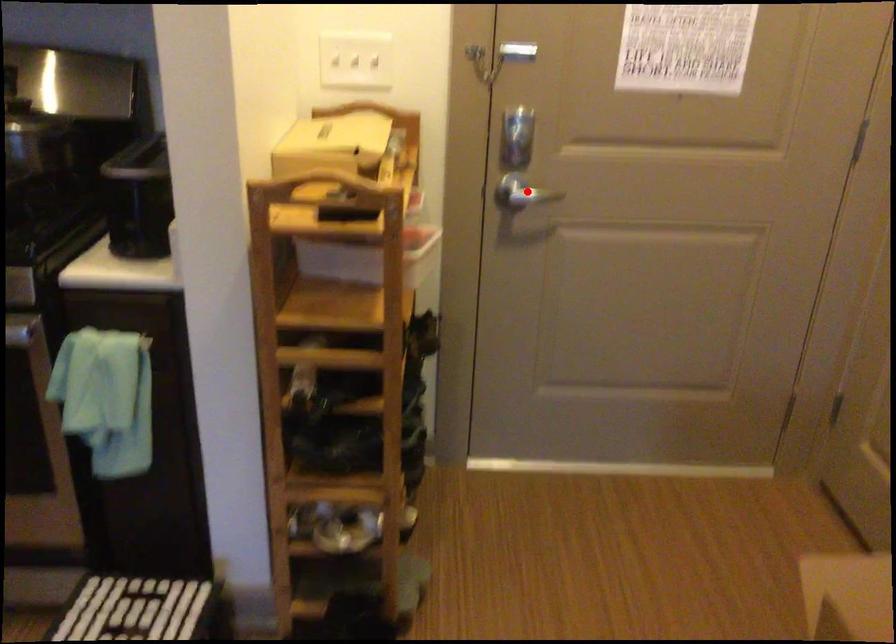
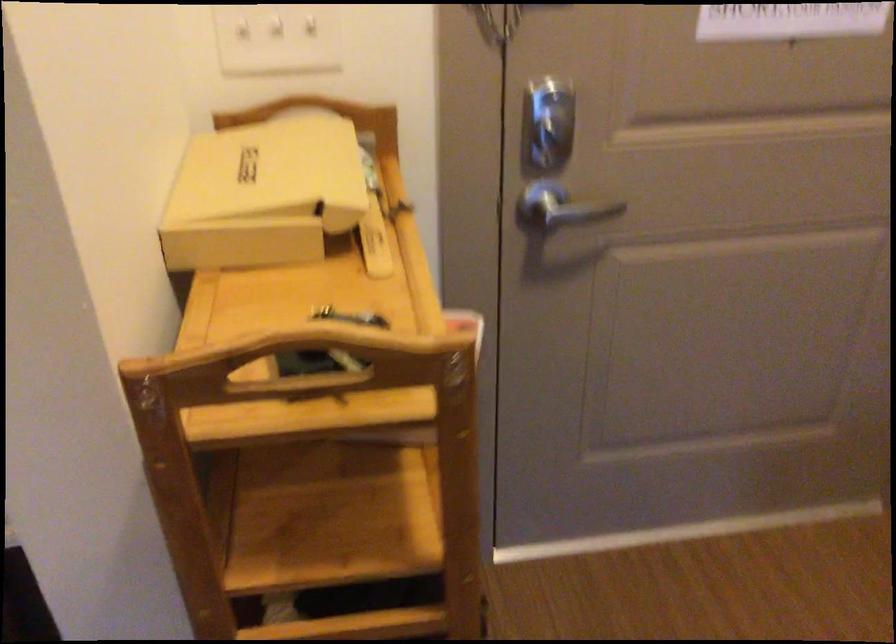
The point at the highlighted location is marked in the first image. Where is the corresponding point in the second image?

(558, 210)